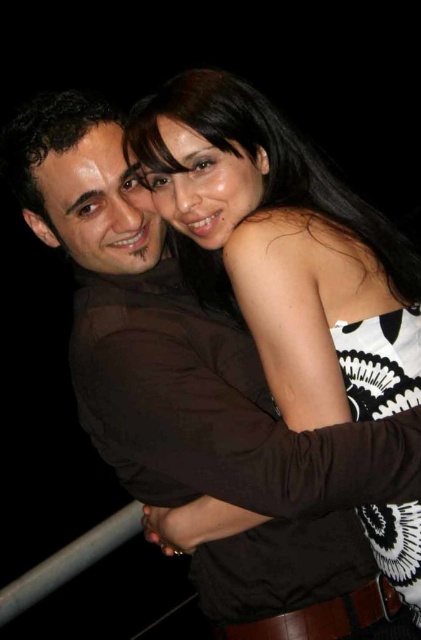
Question: Does black and white printed dress at center appear on the left side of dark brown hair at left?

Choices:
 (A) yes
 (B) no

Answer: (B)

Question: Is black and white printed dress at center above dark brown hair at left?

Choices:
 (A) yes
 (B) no

Answer: (B)

Question: Which of the following is the farthest from the observer?

Choices:
 (A) (394, 326)
 (B) (53, 138)

Answer: (A)

Question: Which of the following is the closest to the observer?

Choices:
 (A) (420, 586)
 (B) (7, 132)

Answer: (B)

Question: Is black and white printed dress at center further to camera compared to dark brown hair at left?

Choices:
 (A) yes
 (B) no

Answer: (A)